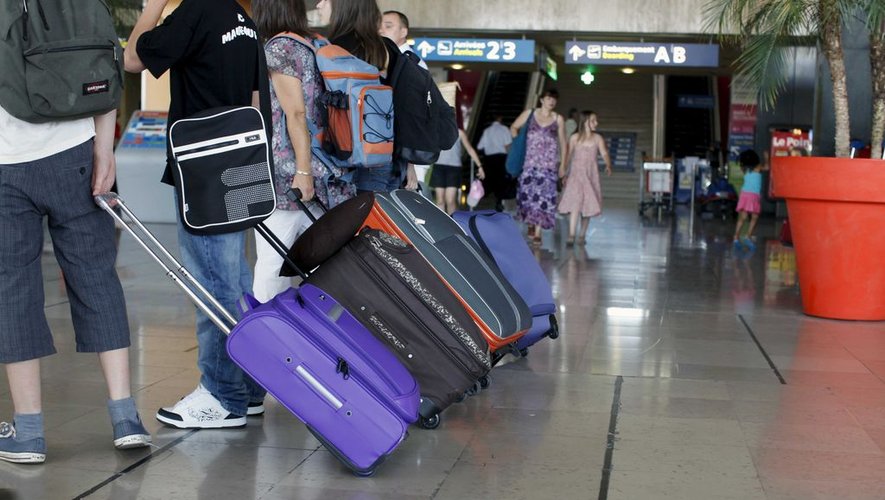
Locate an element on the screen. handles is located at coordinates (314, 383), (385, 332), (290, 190), (104, 198).